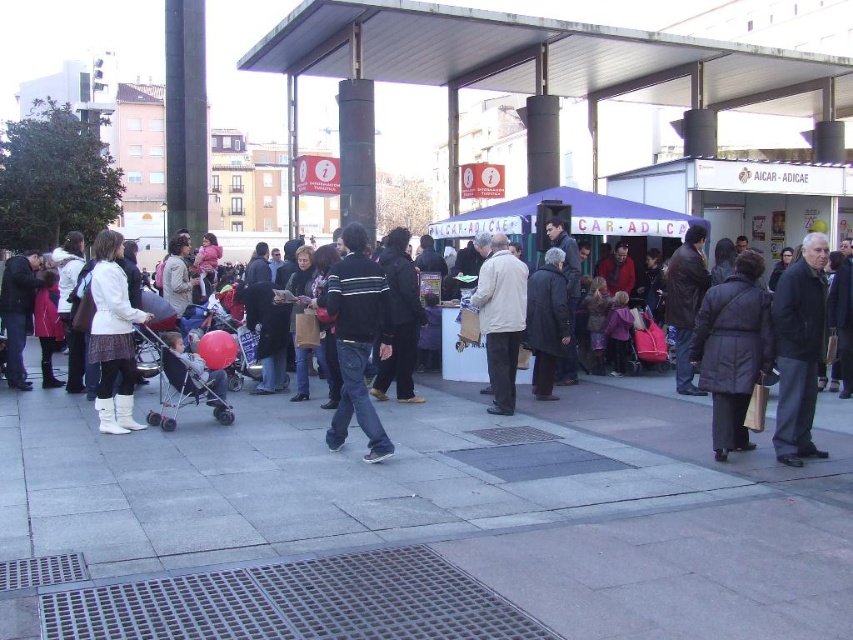
You are a photographer at the event and want to capture both the dark gray jacket at right and the black cotton jacket at center in a single photo. Since you want both jackets to be clearly visible, which jacket should you focus on to ensure the other is in focus as well?

You should focus on the dark gray jacket at right because it is in front of the black cotton jacket at center. By focusing on the closer object, the background object will still be in focus due to the depth of field, ensuring both are visible clearly.

Please provide the coordinates of the dark gray puffer coat at center in the image.

The dark gray puffer coat at center is located at coordinates point (732, 349).